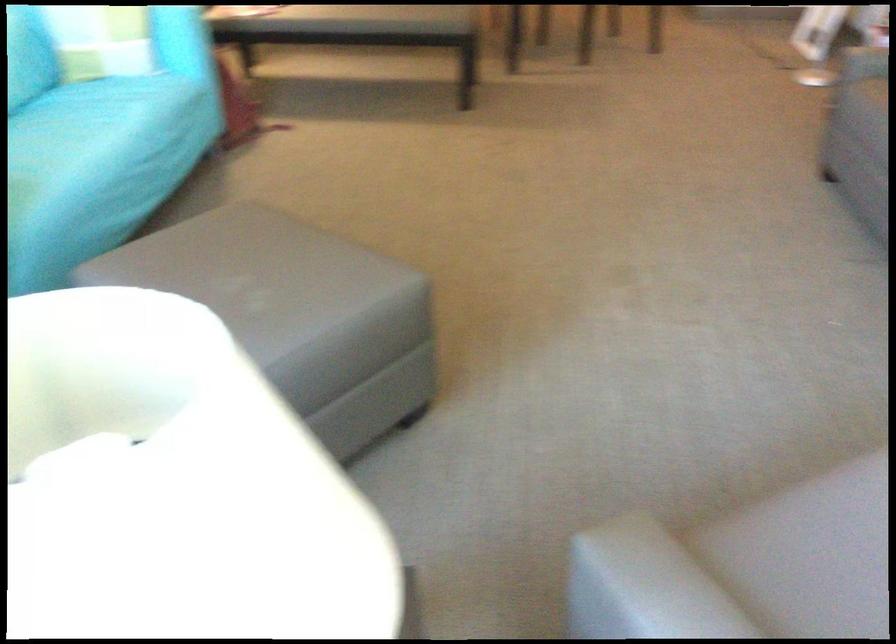
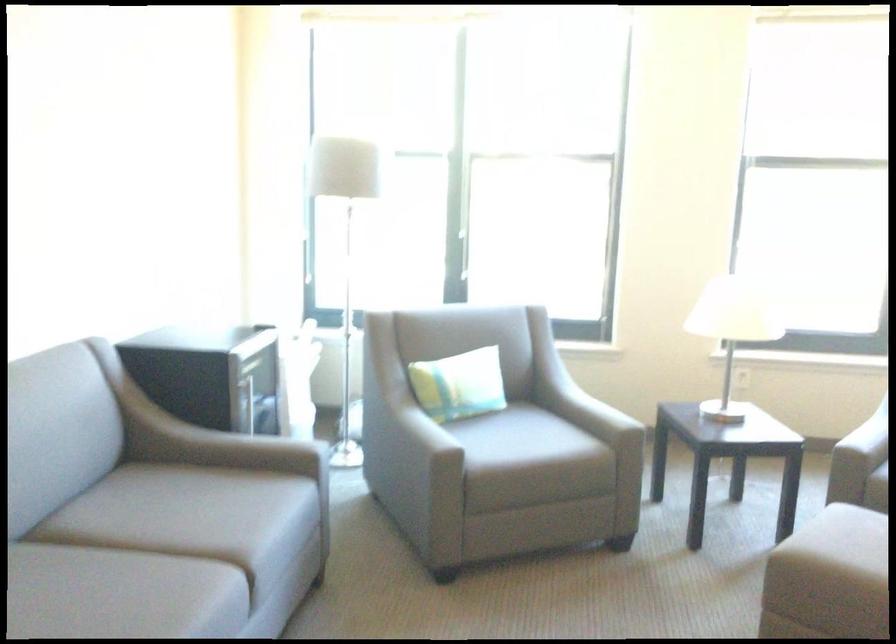
In the second image, find the point that corresponds to point 291,295 in the first image.

(849, 536)